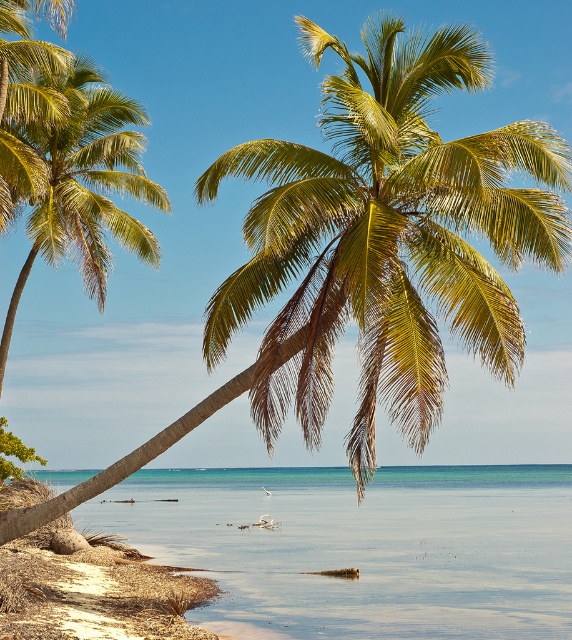
Is clear blue water at center above green leafy palm tree at left?

No, clear blue water at center is not above green leafy palm tree at left.

Between point (273, 580) and point (100, 285), which one is positioned in front?

Point (273, 580) is in front.

What are the coordinates of `clear blue water at center` in the screenshot? It's located at (363, 547).